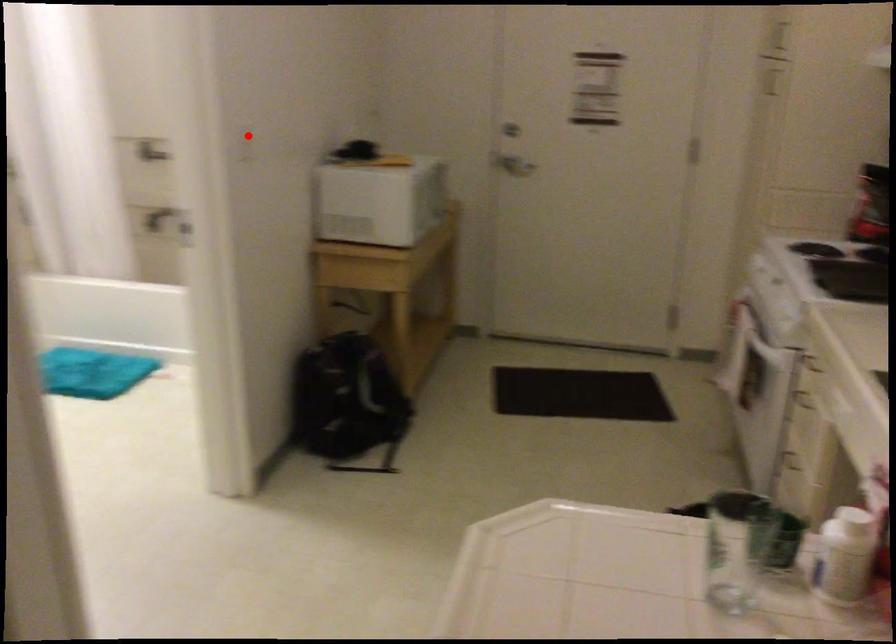
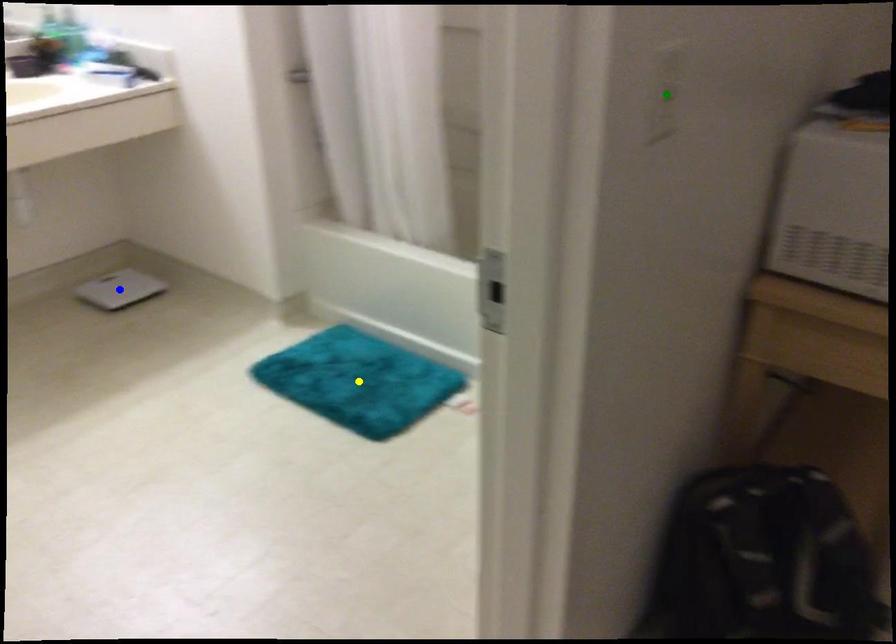
Question: I am providing you with two images of the same scene from different viewpoints. A red point is marked on the first image. You are given multiple points on the second image. Which mark in image 2 goes with the point in image 1?

Choices:
 (A) green point
 (B) blue point
 (C) yellow point

Answer: (A)